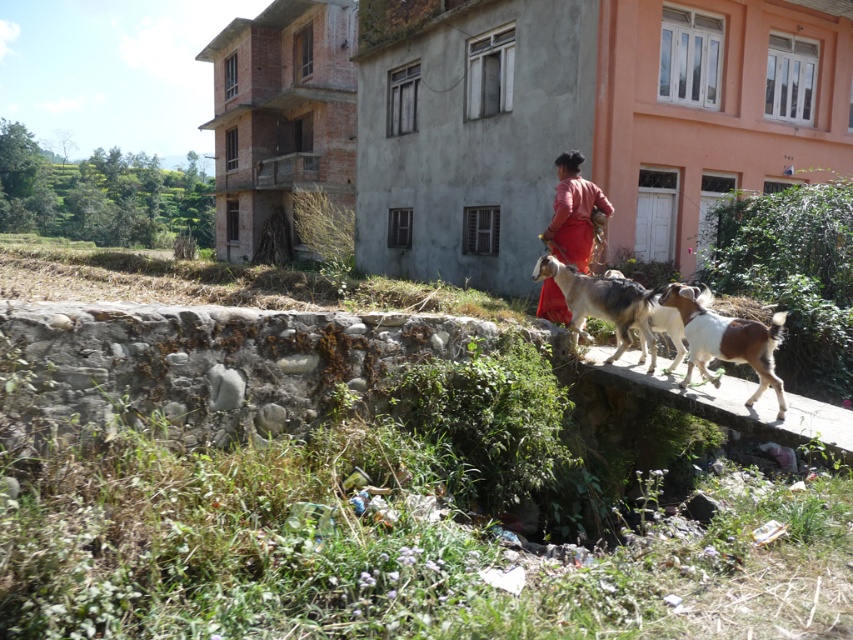
You are a photographer trying to capture the brown stone ledge at center and the white and brown fur at center in the same frame. The minimum distance your camera can focus on two objects is 16 inches. Can both objects be in focus at the same time?

The brown stone ledge at center and white and brown fur at center are 16.96 inches apart from each other. Since the minimum focus distance is 16 inches, the 16.96 inches exceeds this limit, so they cannot both be in focus simultaneously.

You are standing at the point marked by the coordinates point (728, 403). What object are you currently standing on?

You are standing on the brown stone ledge at center marked by the coordinates point (728, 403).

You are a drone operator trying to capture a photo of the white and brown fur at center and the matte red dress at center. The camera has a minimum focus distance of 6 feet. Will both subjects be in focus if you position the drone at the midpoint between them?

The distance between the white and brown fur at center and the matte red dress at center is 6.05 feet. If the drone is placed at the midpoint, each subject will be 3.025 feet away from the camera, which is within the 6 feet minimum focus distance. Therefore, both subjects will be in focus.